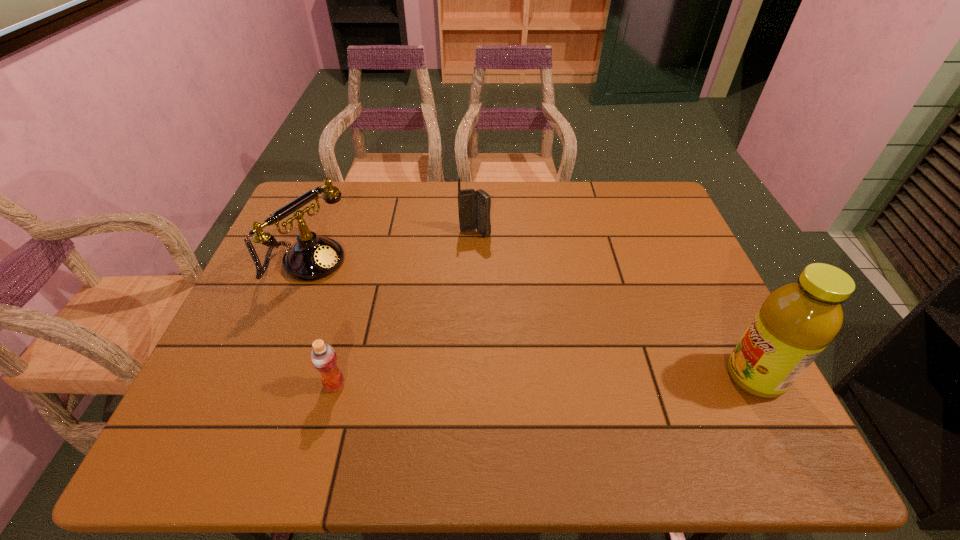
At what (x,y) coordinates should I click in order to perform the action: click on free spot that satisfies the following two spatial constraints: 1. on the back side of the third object from left to right; 2. on the right side of the telephone. Please return your answer as a coordinate pair (x, y). The width and height of the screenshot is (960, 540). Looking at the image, I should click on (319, 233).